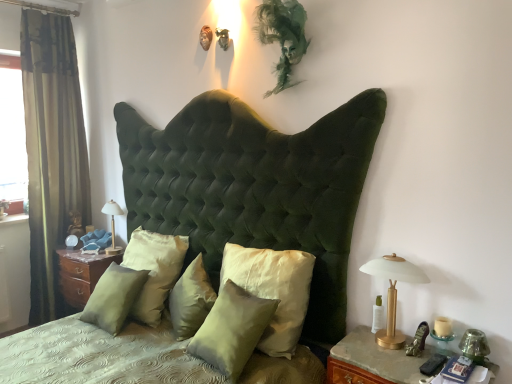
Identify the location of vacant area on top of satin wood nightstand at lower left, marked as the second nightstand in a front-to-back arrangement (from a real-world perspective). The height and width of the screenshot is (384, 512). (81, 253).